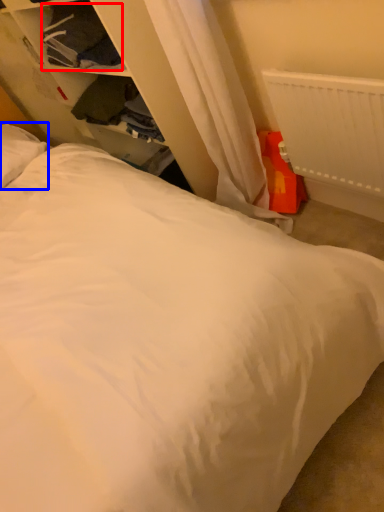
Question: Which object is closer to the camera taking this photo, clothing (highlighted by a red box) or pillow (highlighted by a blue box)?

Choices:
 (A) clothing
 (B) pillow

Answer: (A)